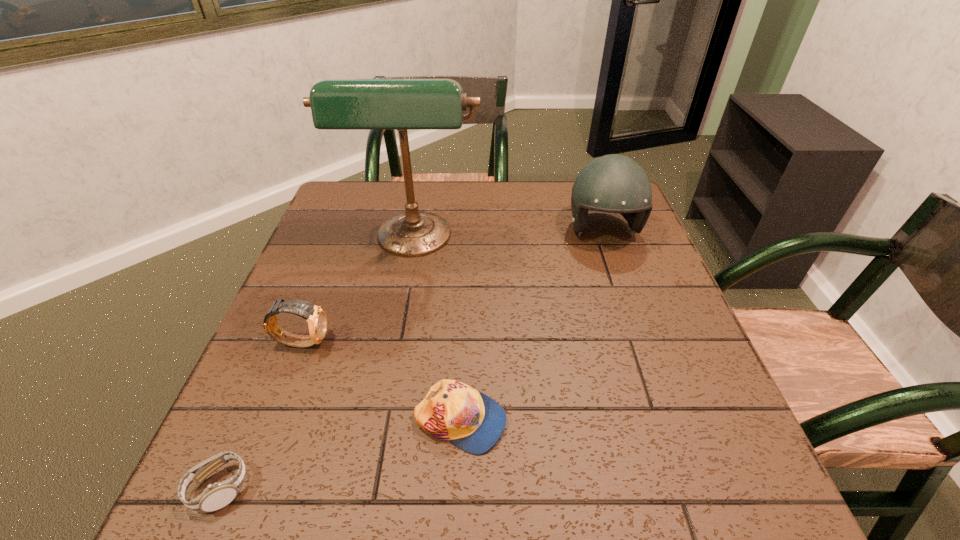
Find the location of a particular element. object that is positioned at the far right corner is located at coordinates (613, 183).

Image resolution: width=960 pixels, height=540 pixels. Find the location of `vacant area at the far edge of the desktop`. vacant area at the far edge of the desktop is located at coordinates (514, 216).

In the image, there is a desktop. At what (x,y) coordinates should I click in order to perform the action: click on free region at the near edge. Please return your answer as a coordinate pair (x, y). Looking at the image, I should click on (554, 491).

This screenshot has height=540, width=960. Find the location of `free spot at the left edge of the desktop`. free spot at the left edge of the desktop is located at coordinates (336, 238).

The image size is (960, 540). I want to click on blank space at the right edge, so click(x=626, y=313).

At what (x,y) coordinates should I click in order to perform the action: click on vacant region at the far left corner of the desktop. Please return your answer as a coordinate pair (x, y). Looking at the image, I should click on (360, 221).

The width and height of the screenshot is (960, 540). What are the coordinates of `vacant space at the near right corner of the desktop` in the screenshot? It's located at (739, 495).

The image size is (960, 540). In order to click on free point between the shortest object and the table lamp in this screenshot , I will do `click(316, 365)`.

Where is `vacant area between the third tallest object and the tallest object`? The width and height of the screenshot is (960, 540). vacant area between the third tallest object and the tallest object is located at coordinates (358, 292).

This screenshot has width=960, height=540. What are the coordinates of `free space between the taller watch and the second nearest object` in the screenshot? It's located at (381, 381).